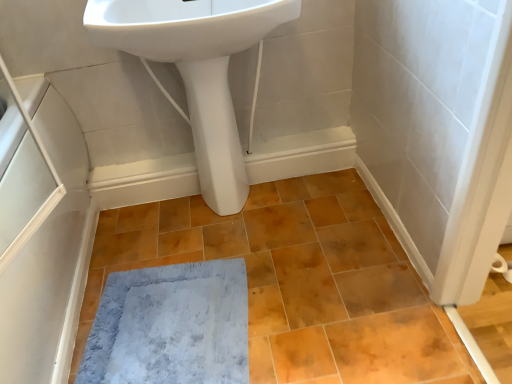
Locate an element on the screen. vacant region under white glossy pedestal at center (from a real-world perspective) is located at coordinates (231, 212).